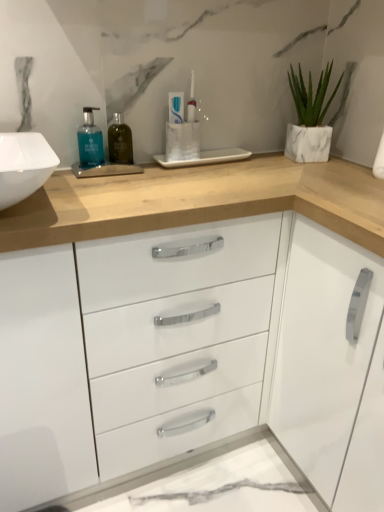
Question: Is white glossy toothpaste at center located within white marble planter at upper right?

Choices:
 (A) no
 (B) yes

Answer: (A)

Question: Considering the relative sizes of white marble planter at upper right and white glossy toothpaste at center in the image provided, is white marble planter at upper right thinner than white glossy toothpaste at center?

Choices:
 (A) yes
 (B) no

Answer: (B)

Question: Is white marble planter at upper right placed right next to white glossy toothpaste at center?

Choices:
 (A) yes
 (B) no

Answer: (B)

Question: From a real-world perspective, does white marble planter at upper right stand above white glossy toothpaste at center?

Choices:
 (A) no
 (B) yes

Answer: (A)

Question: Are white marble planter at upper right and white glossy toothpaste at center located far from each other?

Choices:
 (A) yes
 (B) no

Answer: (B)

Question: In terms of height, does green glass bottle at center, which ranks as the first mouthwash in right-to-left order, look taller or shorter compared to blue glass bottle at upper left, which is counted as the second mouthwash, starting from the right?

Choices:
 (A) tall
 (B) short

Answer: (A)

Question: In the image, is green glass bottle at center, which appears as the 2th mouthwash when viewed from the left, on the left side or the right side of blue glass bottle at upper left, positioned as the 1th mouthwash in left-to-right order?

Choices:
 (A) right
 (B) left

Answer: (A)

Question: In the image, is green glass bottle at center, which ranks as the first mouthwash in right-to-left order, positioned in front of or behind blue glass bottle at upper left, positioned as the 1th mouthwash in left-to-right order?

Choices:
 (A) behind
 (B) front

Answer: (A)

Question: Does point (115, 138) appear closer or farther from the camera than point (89, 119)?

Choices:
 (A) closer
 (B) farther

Answer: (B)

Question: In the image, is blue glass bottle at upper left, which is counted as the second mouthwash, starting from the right, positioned in front of or behind white glossy toothpaste at center?

Choices:
 (A) front
 (B) behind

Answer: (A)

Question: From a real-world perspective, is blue glass bottle at upper left, which is counted as the second mouthwash, starting from the right, physically located above or below white glossy toothpaste at center?

Choices:
 (A) below
 (B) above

Answer: (A)

Question: Is blue glass bottle at upper left, positioned as the 1th mouthwash in left-to-right order, taller or shorter than white glossy toothpaste at center?

Choices:
 (A) short
 (B) tall

Answer: (B)

Question: From the image's perspective, relative to white glossy toothpaste at center, is blue glass bottle at upper left, positioned as the 1th mouthwash in left-to-right order, above or below?

Choices:
 (A) below
 (B) above

Answer: (A)

Question: In terms of height, does blue glass bottle at upper left, positioned as the 1th mouthwash in left-to-right order, look taller or shorter compared to white marble planter at upper right?

Choices:
 (A) short
 (B) tall

Answer: (A)

Question: From a real-world perspective, is blue glass bottle at upper left, positioned as the 1th mouthwash in left-to-right order, above or below white marble planter at upper right?

Choices:
 (A) below
 (B) above

Answer: (A)